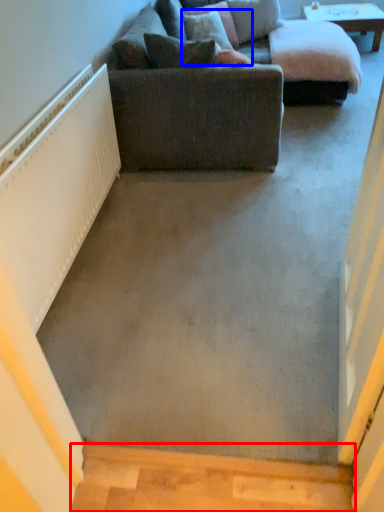
Question: Among these objects, which one is nearest to the camera, stairwell (highlighted by a red box) or pillow (highlighted by a blue box)?

Choices:
 (A) stairwell
 (B) pillow

Answer: (A)